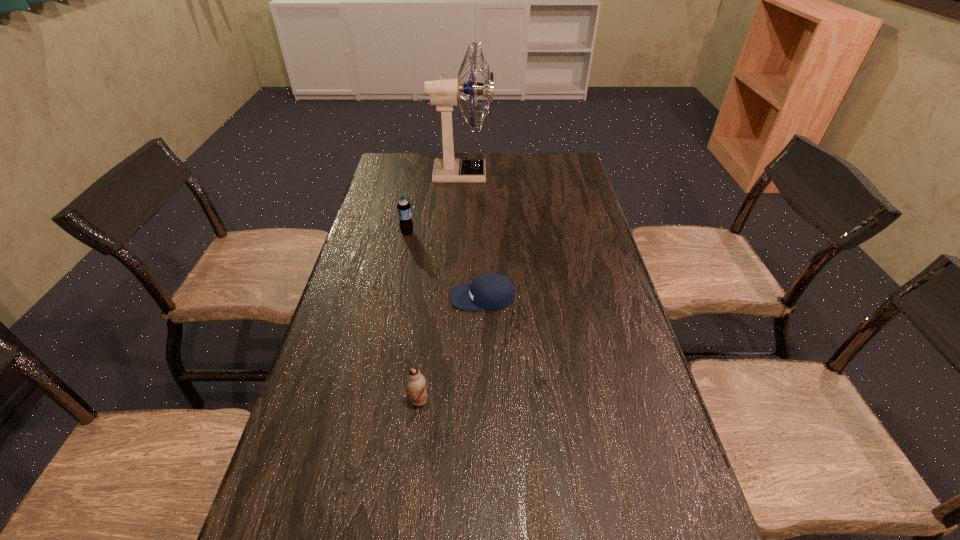
Locate an element on the screen. free space located on the right of the nearest object is located at coordinates (492, 401).

You are a GUI agent. You are given a task and a screenshot of the screen. Output one action in this format:
    pyautogui.click(x=<x>, y=<y>)
    Task: Click on the free space located 0.210m on the front-facing side of the baseball cap
    The width and height of the screenshot is (960, 540).
    Given the screenshot: What is the action you would take?
    pyautogui.click(x=372, y=298)

This screenshot has height=540, width=960. Find the location of `vacant space situated on the front-facing side of the baseball cap`. vacant space situated on the front-facing side of the baseball cap is located at coordinates [395, 298].

Identify the location of vacant space located 0.300m on the front-facing side of the baseball cap. (339, 298).

Identify the location of object present at the far edge. (445, 93).

Where is `object at the left edge`? This screenshot has width=960, height=540. object at the left edge is located at coordinates (404, 208).

Where is `vacant space at the left edge of the desktop`? The height and width of the screenshot is (540, 960). vacant space at the left edge of the desktop is located at coordinates (396, 217).

Where is `free spot at the right edge of the desktop`? The width and height of the screenshot is (960, 540). free spot at the right edge of the desktop is located at coordinates (602, 394).

In the image, there is a desktop. At what (x,y) coordinates should I click in order to perform the action: click on free space at the far left corner. Please return your answer as a coordinate pair (x, y). The height and width of the screenshot is (540, 960). Looking at the image, I should click on (382, 164).

In the image, there is a desktop. In order to click on vacant space at the far right corner in this screenshot , I will do `click(563, 166)`.